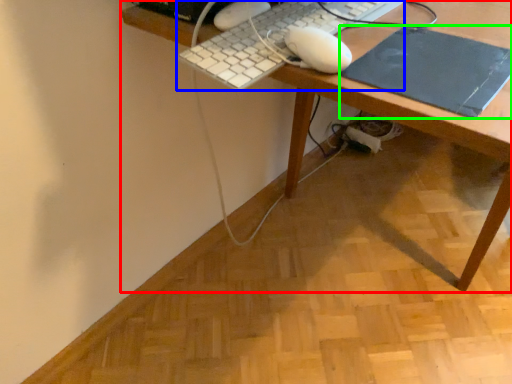
Question: Estimate the real-world distances between objects in this image. Which object is farther from desk (highlighted by a red box), computer keyboard (highlighted by a blue box) or mousepad (highlighted by a green box)?

Choices:
 (A) computer keyboard
 (B) mousepad

Answer: (A)